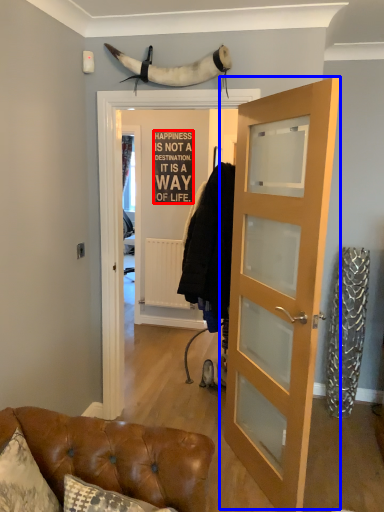
Question: Which object is closer to the camera taking this photo, writing (highlighted by a red box) or door (highlighted by a blue box)?

Choices:
 (A) writing
 (B) door

Answer: (B)